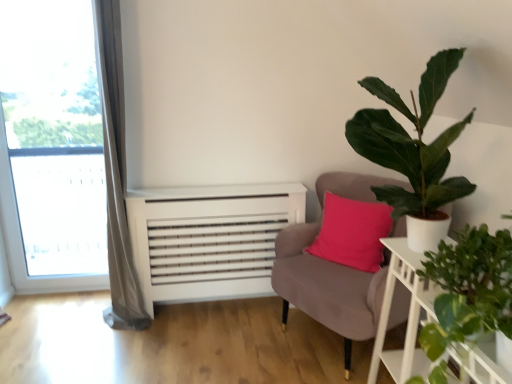
This screenshot has width=512, height=384. Identify the location of vacant space in velvet pink chair at center (from a real-world perspective). (325, 342).